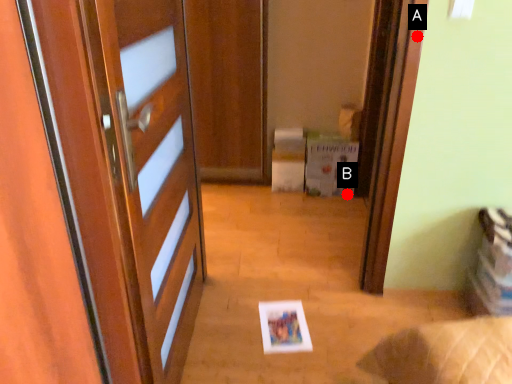
Question: Two points are circled on the image, labeled by A and B beside each circle. Which point appears closest to the camera in this image?

Choices:
 (A) A is closer
 (B) B is closer

Answer: (A)